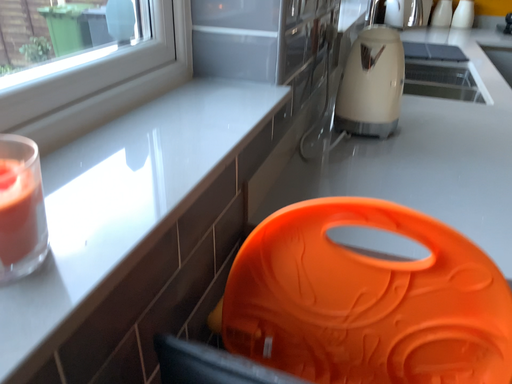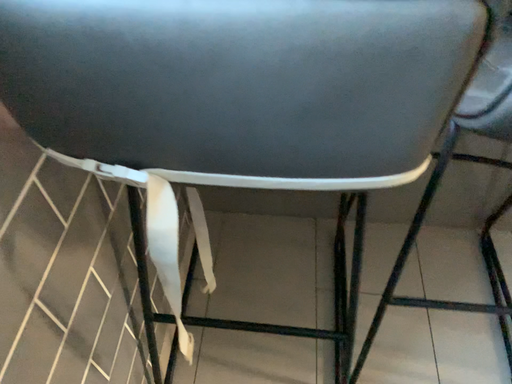
Question: Which way did the camera rotate in the video?

Choices:
 (A) rotated left
 (B) rotated right

Answer: (B)